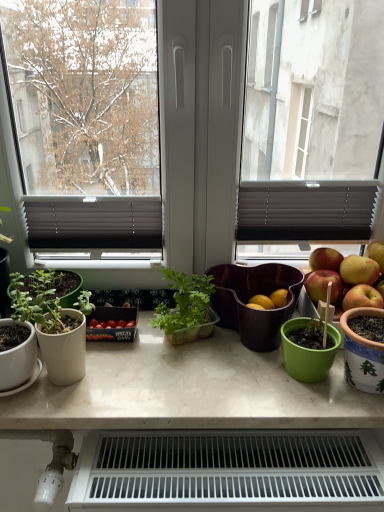
Locate an element on the screen. free region on the left part of christmas-patterned ceramic pot at right is located at coordinates (282, 394).